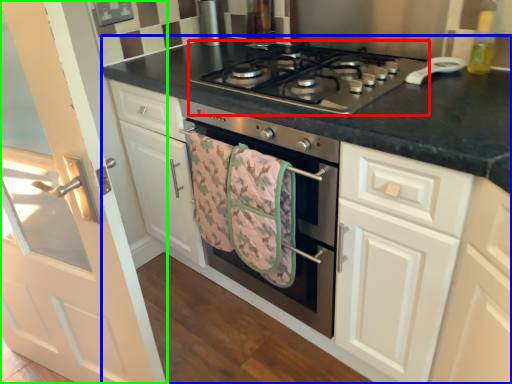
Question: Which object is the farthest from gas stove (highlighted by a red box)? Choose among these: countertop (highlighted by a blue box) or door (highlighted by a green box).

Choices:
 (A) countertop
 (B) door

Answer: (B)